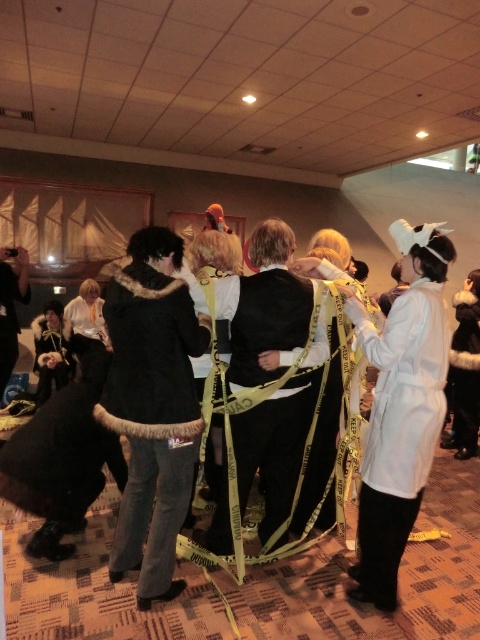
Is point (87, 595) in front of point (305, 397)?

Yes, point (87, 595) is in front of point (305, 397).

Is fur-trimmed coat at center taller than black satin robe at center?

In fact, fur-trimmed coat at center may be shorter than black satin robe at center.

Does point (47, 566) lie in front of point (239, 451)?

No, it is not.

What are the coordinates of `fur-trimmed coat at center` in the screenshot? It's located at (350, 580).

Between point (409, 593) and point (0, 355), which one is positioned in front?

Point (409, 593) is in front.

Does fur-trimmed coat at center have a lesser height compared to velvet black robe at lower left?

Correct, fur-trimmed coat at center is not as tall as velvet black robe at lower left.

Does point (228, 276) lie behind point (0, 394)?

No, it is in front of (0, 394).

Identify the location of fur-trimmed coat at center. This screenshot has width=480, height=640. (350, 580).

Who is more distant from viewer, (381, 536) or (284, 477)?

The point (284, 477) is more distant.

Does point (433, 348) come closer to viewer compared to point (264, 294)?

Yes, point (433, 348) is in front of point (264, 294).

Which is in front, point (411, 404) or point (261, 340)?

Point (411, 404)

Where is `white matte coat at center`? The width and height of the screenshot is (480, 640). white matte coat at center is located at coordinates (399, 433).